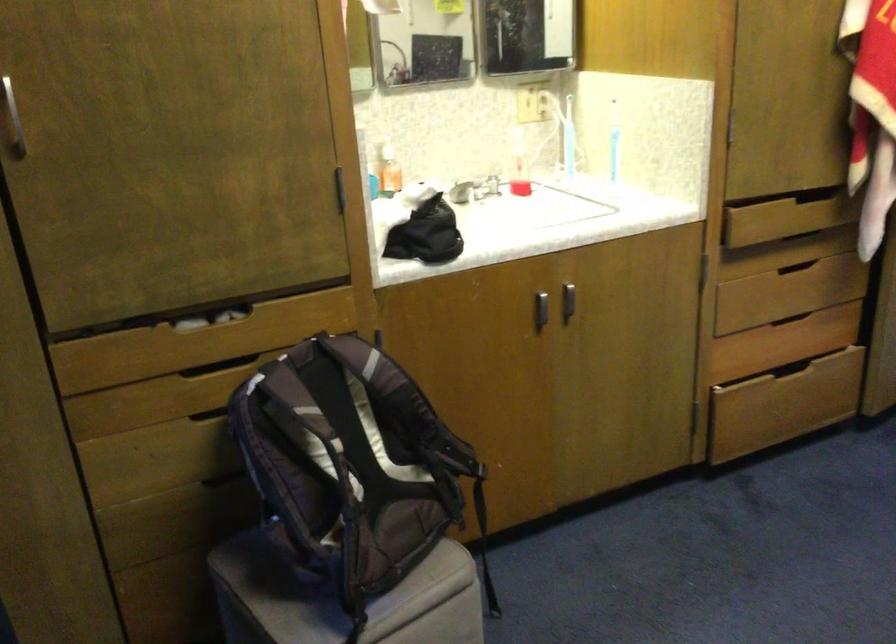
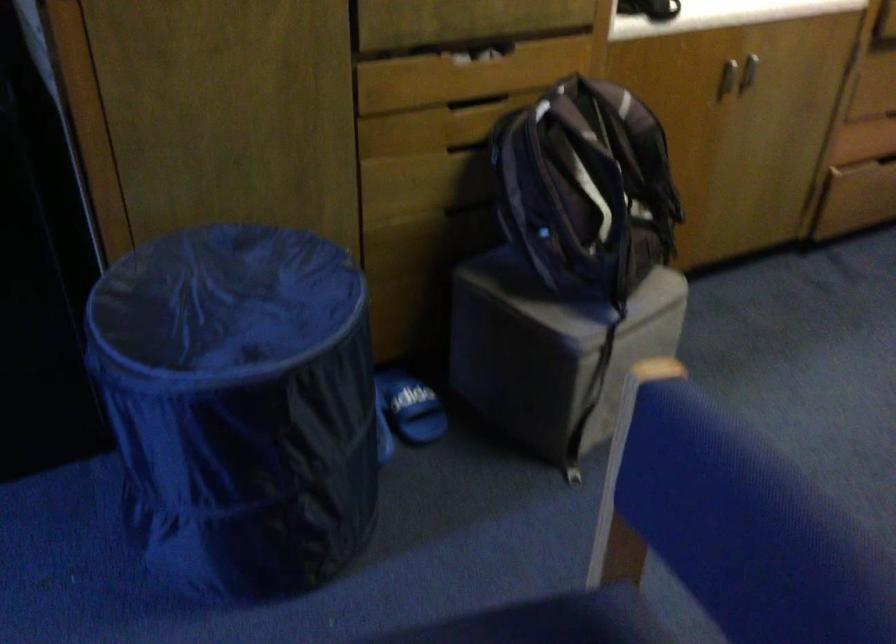
Where in the second image is the point corresponding to (x=230, y=368) from the first image?

(476, 102)